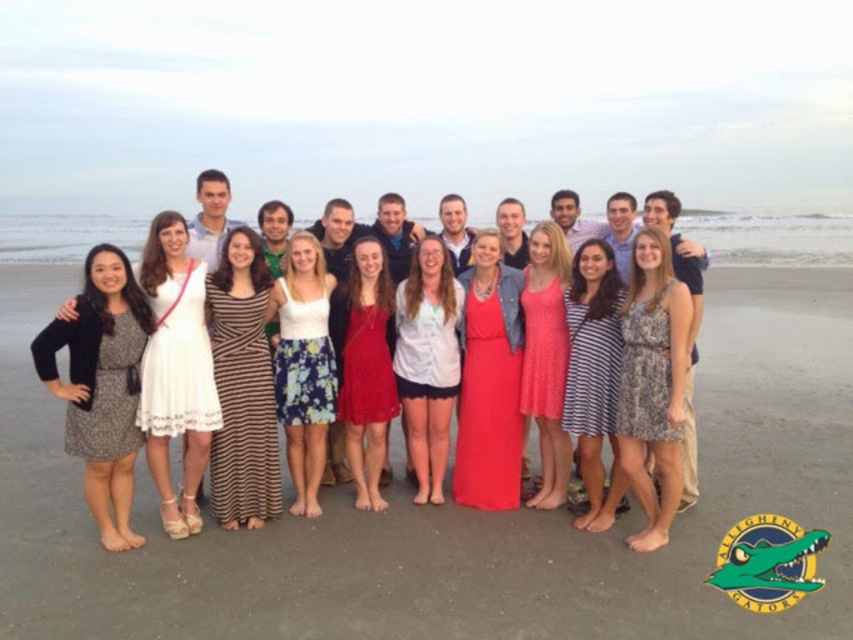
Based on the photo, is white cotton shirt at center closer to the viewer compared to red satin dress at center?

No, white cotton shirt at center is further to the viewer.

Does point (440, 392) come closer to viewer compared to point (352, 392)?

No.

Which is behind, point (409, 310) or point (376, 438)?

The point (409, 310) is behind.

The width and height of the screenshot is (853, 640). I want to click on white cotton shirt at center, so click(x=427, y=362).

Can you confirm if matte pink dress at center is positioned above white cotton shirt at center?

Yes.

Does matte pink dress at center have a lesser height compared to white cotton shirt at center?

Incorrect, matte pink dress at center's height does not fall short of white cotton shirt at center's.

The height and width of the screenshot is (640, 853). What do you see at coordinates (489, 381) in the screenshot? I see `matte pink dress at center` at bounding box center [489, 381].

Where is `matte pink dress at center`? matte pink dress at center is located at coordinates (489, 381).

Based on the photo, is matte pink dress at center to the right of pink dotted dress at center from the viewer's perspective?

Incorrect, matte pink dress at center is not on the right side of pink dotted dress at center.

Based on the photo, can you confirm if matte pink dress at center is positioned above pink dotted dress at center?

Actually, matte pink dress at center is below pink dotted dress at center.

Which is in front, point (502, 422) or point (543, 220)?

Positioned in front is point (502, 422).

In order to click on matte pink dress at center in this screenshot , I will do pyautogui.click(x=489, y=381).